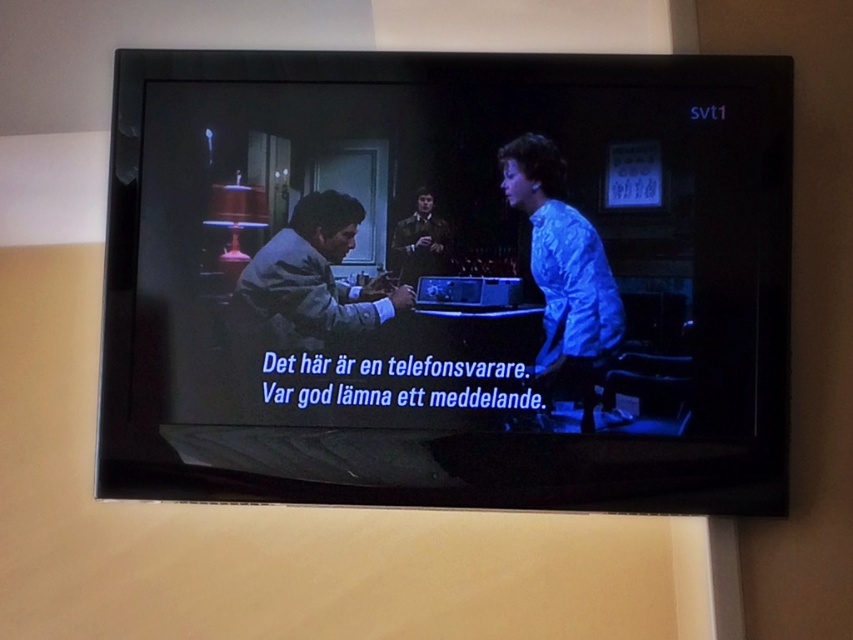
Question: Does matte black television at center have a lesser width compared to gray fabric shirt at center?

Choices:
 (A) yes
 (B) no

Answer: (B)

Question: Among these objects, which one is farthest from the camera?

Choices:
 (A) gray fabric shirt at center
 (B) matte black television at center

Answer: (A)

Question: Is blue satin blouse at center in front of gray fabric shirt at center?

Choices:
 (A) yes
 (B) no

Answer: (A)

Question: Which object appears closest to the camera in this image?

Choices:
 (A) shiny black suit at center
 (B) blue satin blouse at center

Answer: (B)

Question: Among these objects, which one is farthest from the camera?

Choices:
 (A) blue satin blouse at center
 (B) gray fabric shirt at center

Answer: (B)

Question: Does matte black television at center have a smaller size compared to shiny black suit at center?

Choices:
 (A) no
 (B) yes

Answer: (A)